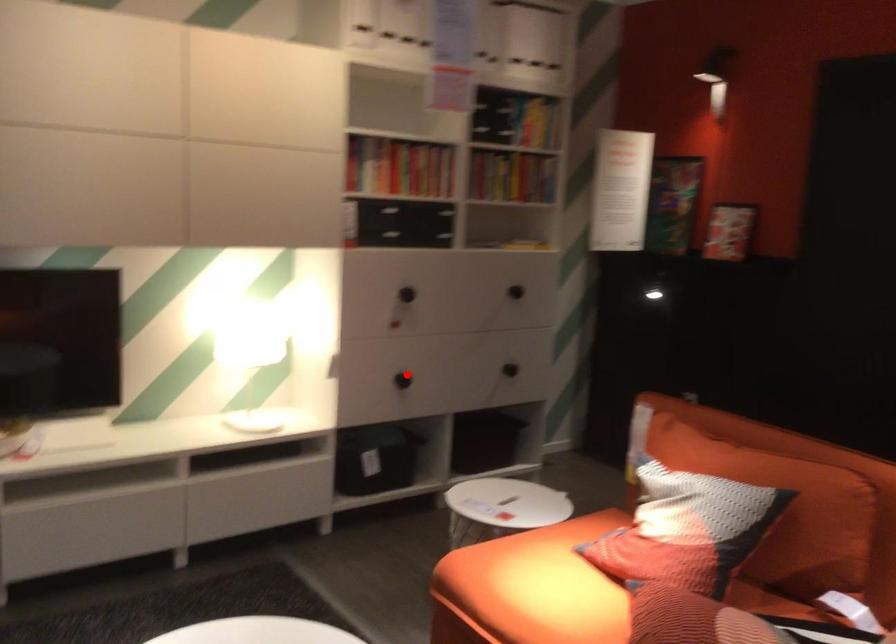
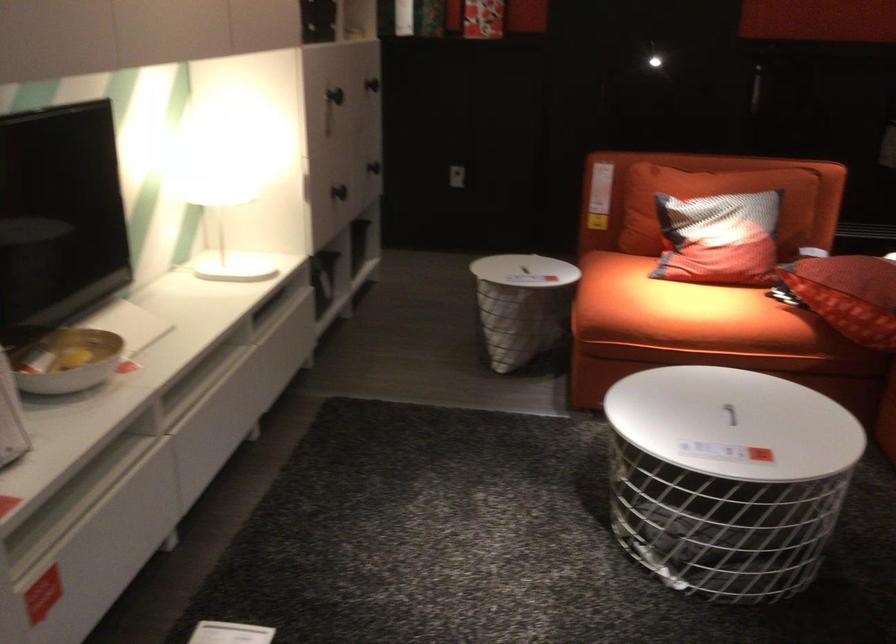
Locate, in the second image, the point that corresponds to the highlighted location in the first image.

(339, 192)